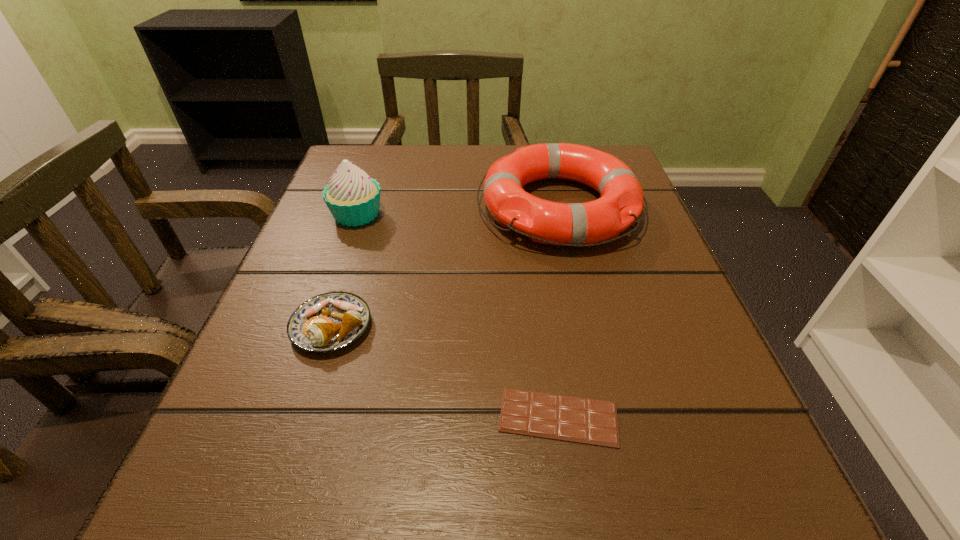
Identify the location of cupcake that is at the far edge. The image size is (960, 540). (353, 198).

Where is `life buoy at the far edge`? life buoy at the far edge is located at coordinates (575, 224).

The width and height of the screenshot is (960, 540). In order to click on cupcake that is at the left edge in this screenshot , I will do `click(353, 198)`.

The image size is (960, 540). What are the coordinates of `pastry positioned at the left edge` in the screenshot? It's located at (328, 322).

Find the location of a particular element. This screenshot has width=960, height=540. life buoy that is at the right edge is located at coordinates (575, 224).

Find the location of a particular element. The width and height of the screenshot is (960, 540). chocolate bar present at the right edge is located at coordinates (580, 420).

The width and height of the screenshot is (960, 540). What are the coordinates of `object that is at the far left corner` in the screenshot? It's located at (353, 198).

Image resolution: width=960 pixels, height=540 pixels. What are the coordinates of `object situated at the far right corner` in the screenshot? It's located at (575, 224).

In the image, there is a desktop. Identify the location of free region at the far edge. (536, 190).

The image size is (960, 540). I want to click on vacant space at the near edge of the desktop, so click(348, 470).